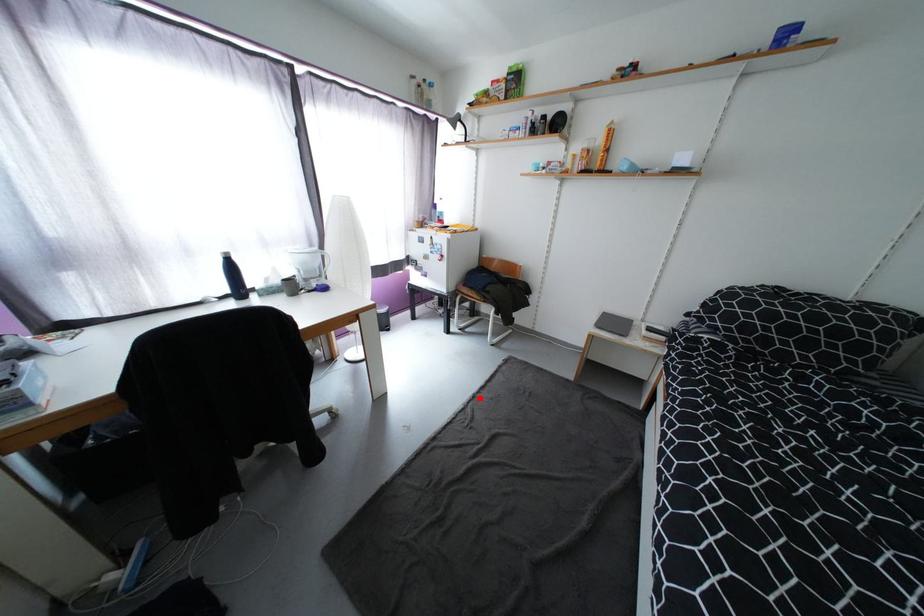
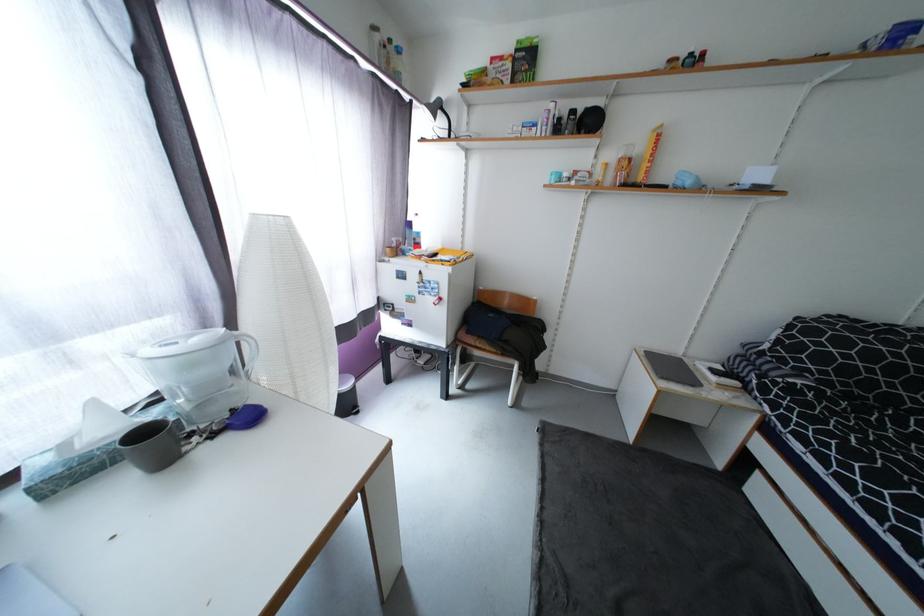
In the second image, find the point that corresponds to the highlighted location in the first image.

(548, 524)